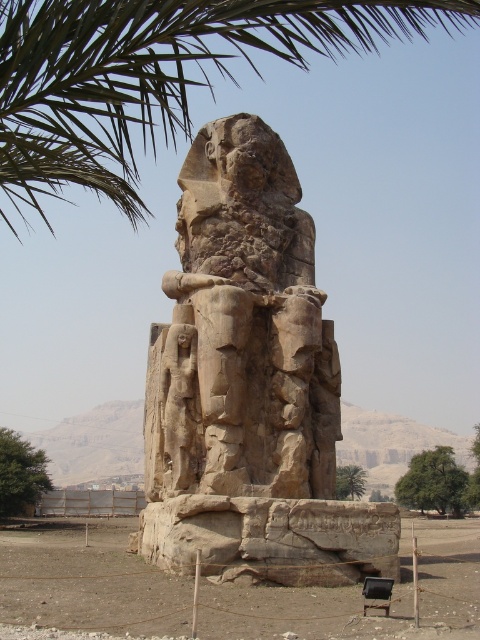
Question: Is green leafy tree at lower right positioned in front of green leafy tree at lower left?

Choices:
 (A) no
 (B) yes

Answer: (A)

Question: Can you confirm if green leafy palm tree at upper left is positioned above green leafy tree at lower left?

Choices:
 (A) yes
 (B) no

Answer: (A)

Question: Based on their relative distances, which object is farther from the green leafy palm tree at upper left?

Choices:
 (A) green leafy tree at lower left
 (B) green leafy tree at lower center
 (C) green leafy tree at lower right
 (D) rough stone statue at center

Answer: (C)

Question: Does rough stone statue at center have a smaller size compared to green leafy tree at lower right?

Choices:
 (A) no
 (B) yes

Answer: (A)

Question: Based on their relative distances, which object is nearer to the green leafy tree at lower center?

Choices:
 (A) green leafy palm tree at upper left
 (B) rough stone statue at center
 (C) green leafy tree at lower right

Answer: (C)

Question: Estimate the real-world distances between objects in this image. Which object is farther from the green leafy palm tree at upper left?

Choices:
 (A) green leafy tree at lower center
 (B) rough stone statue at center

Answer: (A)